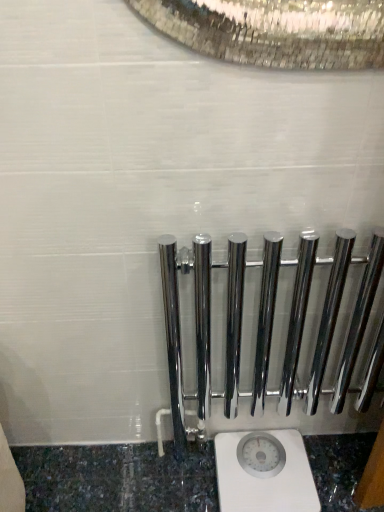
Question: Is polished chrome rail at center located outside white plastic scale at lower center?

Choices:
 (A) no
 (B) yes

Answer: (B)

Question: Considering the relative sizes of polished chrome rail at center and white plastic scale at lower center in the image provided, is polished chrome rail at center thinner than white plastic scale at lower center?

Choices:
 (A) yes
 (B) no

Answer: (A)

Question: Is polished chrome rail at center behind white plastic scale at lower center?

Choices:
 (A) yes
 (B) no

Answer: (B)

Question: Considering the relative sizes of polished chrome rail at center and white plastic scale at lower center in the image provided, is polished chrome rail at center bigger than white plastic scale at lower center?

Choices:
 (A) no
 (B) yes

Answer: (B)

Question: Is there a large distance between polished chrome rail at center and white plastic scale at lower center?

Choices:
 (A) no
 (B) yes

Answer: (A)

Question: Does polished chrome rail at center touch white plastic scale at lower center?

Choices:
 (A) no
 (B) yes

Answer: (A)

Question: Is white plastic scale at lower center in contact with polished chrome rail at center?

Choices:
 (A) yes
 (B) no

Answer: (B)

Question: Considering the relative positions of white plastic scale at lower center and polished chrome rail at center in the image provided, is white plastic scale at lower center to the left of polished chrome rail at center from the viewer's perspective?

Choices:
 (A) no
 (B) yes

Answer: (B)

Question: From a real-world perspective, is white plastic scale at lower center on top of polished chrome rail at center?

Choices:
 (A) yes
 (B) no

Answer: (B)

Question: From the image's perspective, is white plastic scale at lower center below polished chrome rail at center?

Choices:
 (A) yes
 (B) no

Answer: (A)

Question: Is white plastic scale at lower center at the right side of polished chrome rail at center?

Choices:
 (A) yes
 (B) no

Answer: (B)

Question: Would you say polished chrome rail at center is part of white plastic scale at lower center's contents?

Choices:
 (A) yes
 (B) no

Answer: (B)

Question: From their relative heights in the image, would you say polished chrome rail at center is taller or shorter than white plastic scale at lower center?

Choices:
 (A) tall
 (B) short

Answer: (A)